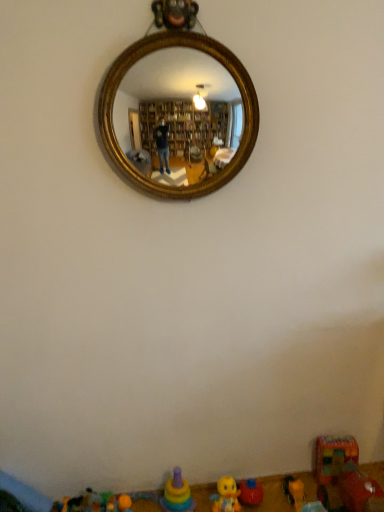
I want to click on empty space that is to the right of multicolored plastic stacking rings at lower center, acting as the 5th toy starting from the right, so click(213, 494).